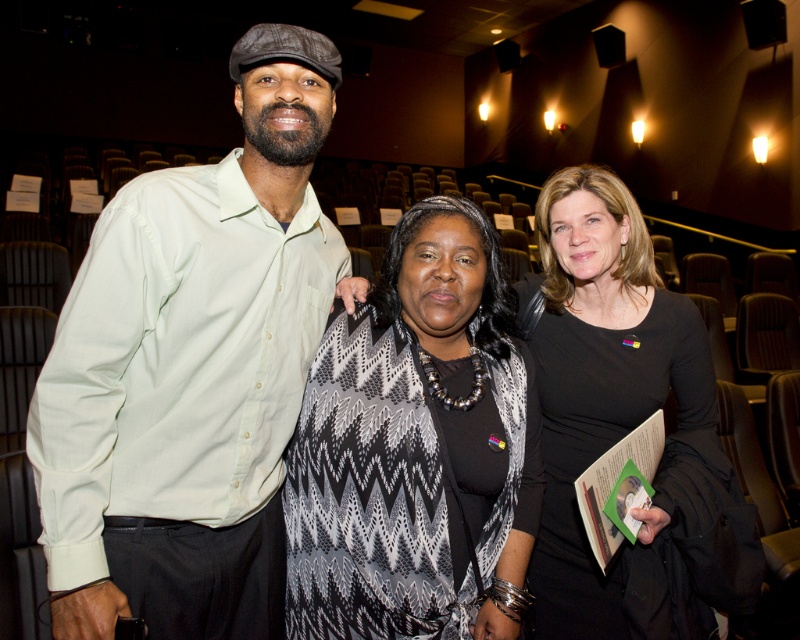
Can you confirm if matte green shirt at center is positioned to the right of black and white zigzag scarf at center?

No, matte green shirt at center is not to the right of black and white zigzag scarf at center.

Who is lower down, matte green shirt at center or black and white zigzag scarf at center?

black and white zigzag scarf at center

This screenshot has width=800, height=640. Find the location of `matte green shirt at center`. matte green shirt at center is located at coordinates (192, 371).

The image size is (800, 640). Identify the location of matte green shirt at center. (192, 371).

This screenshot has height=640, width=800. Describe the element at coordinates (412, 452) in the screenshot. I see `black and white zigzag scarf at center` at that location.

Can you confirm if black and white zigzag scarf at center is wider than black matte dress at center?

Indeed, black and white zigzag scarf at center has a greater width compared to black matte dress at center.

Who is more distant from viewer, (286, 632) or (564, 593)?

Point (564, 593)

Find the location of a particular element. This screenshot has width=800, height=640. black and white zigzag scarf at center is located at coordinates (412, 452).

Is matte green shirt at center taller than black matte dress at center?

Yes, matte green shirt at center is taller than black matte dress at center.

Looking at this image, does matte green shirt at center have a larger size compared to black matte dress at center?

Yes, matte green shirt at center is bigger than black matte dress at center.

Which is behind, point (220, 321) or point (562, 284)?

The point (562, 284) is behind.

This screenshot has width=800, height=640. Find the location of `matte green shirt at center`. matte green shirt at center is located at coordinates (192, 371).